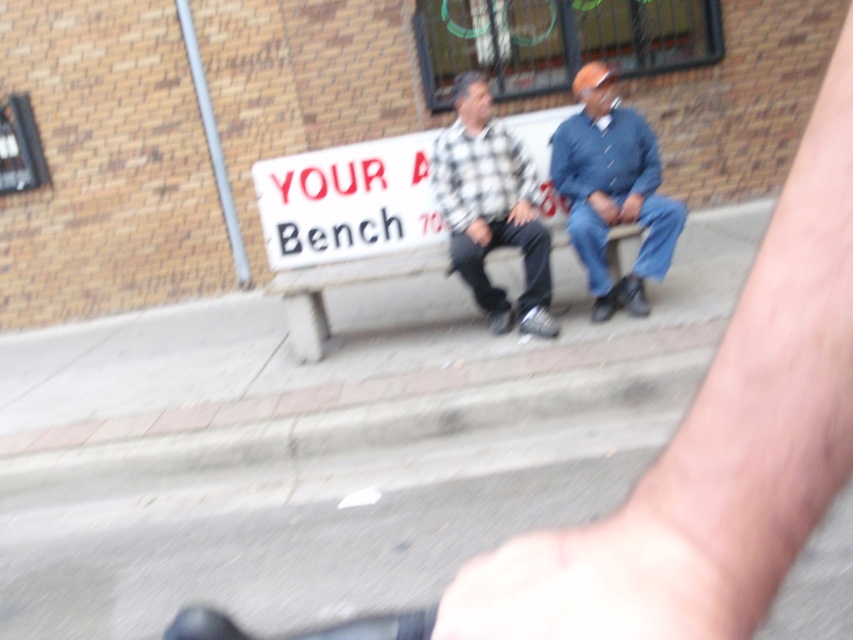
This screenshot has height=640, width=853. What do you see at coordinates (347, 202) in the screenshot?
I see `white plastic sign at center` at bounding box center [347, 202].

Is white plastic sign at center smaller than concrete bench at center?

Yes.

Does point (380, 163) come farther from viewer compared to point (271, 282)?

No, (380, 163) is in front of (271, 282).

Where is `white plastic sign at center`? The image size is (853, 640). white plastic sign at center is located at coordinates (347, 202).

What do you see at coordinates (612, 189) in the screenshot? This screenshot has width=853, height=640. I see `blue denim jeans at center` at bounding box center [612, 189].

Is blue denim jeans at center bigger than concrete bench at center?

No, blue denim jeans at center is not bigger than concrete bench at center.

Is point (618, 115) behind point (294, 276)?

No, (618, 115) is closer to viewer.

The image size is (853, 640). In order to click on blue denim jeans at center in this screenshot , I will do `click(612, 189)`.

Does checkered fabric shirt at center have a larger size compared to concrete bench at center?

No.

Which is in front, point (480, 212) or point (387, 276)?

Point (387, 276)

Where is `checkered fabric shirt at center`? checkered fabric shirt at center is located at coordinates (491, 208).